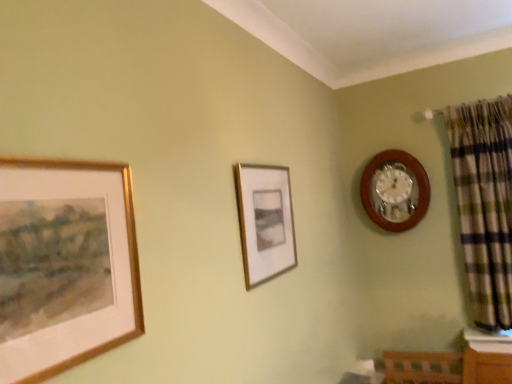
Question: From the image's perspective, is matte gold picture frame at center, arranged as the 2th picture frame when viewed from the front, above or below green plaid fabric at right?

Choices:
 (A) above
 (B) below

Answer: (A)

Question: Is point (247, 221) positioned closer to the camera than point (480, 115)?

Choices:
 (A) closer
 (B) farther

Answer: (A)

Question: Which object is positioned farthest from the wooden wall clock at upper right?

Choices:
 (A) green plaid fabric at right
 (B) matte gold picture frame at center, positioned as the second picture frame in left-to-right order
 (C) gold-framed painting at left, which ranks as the 1th picture frame in front-to-back order

Answer: (C)

Question: Which is farther from the matte gold picture frame at center, positioned as the second picture frame in left-to-right order?

Choices:
 (A) gold-framed painting at left, which ranks as the 1th picture frame in front-to-back order
 (B) wooden wall clock at upper right
 (C) green plaid fabric at right

Answer: (C)